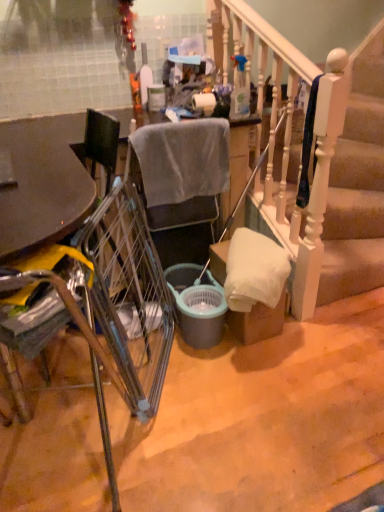
Locate an element on the screen. vacant area that is in front of matte gray bucket at center is located at coordinates tap(215, 381).